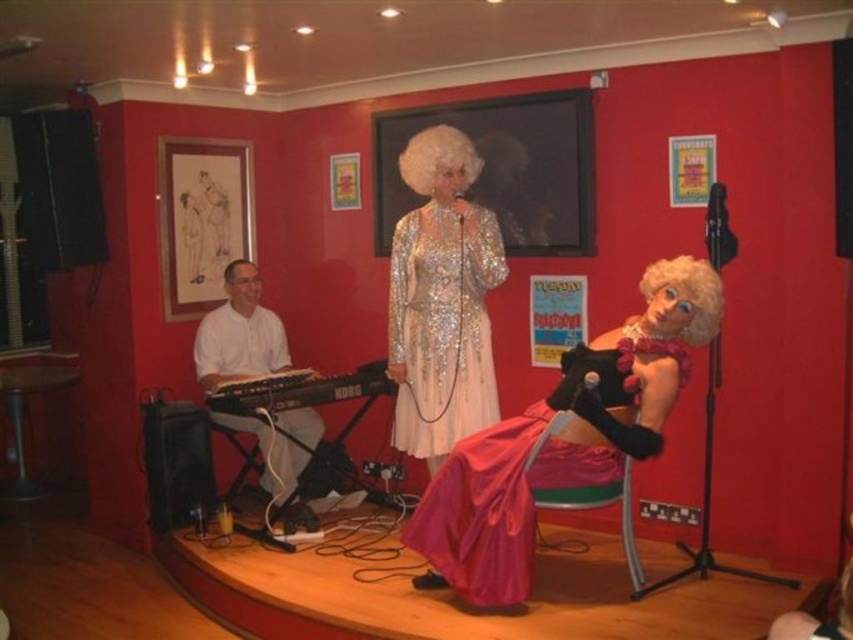
You are a stagehand setting up a new microphone stand. There is a white matte keyboard at left located at point (239, 336). Where should you place the microphone stand so it doesn

The microphone stand should be placed near the white matte keyboard at left at point (239, 336) to ensure the performer can easily access it while playing.

You are a stagehand setting up a spotlight for the performer. The spotlight needs to be positioned so that it can illuminate both the white matte keyboard at left and the white curly wig at upper center without moving. Since the spotlight has a fixed angle, you need to ensure that the taller object is placed closer to the back of the stage to avoid casting a shadow over the shorter one. Which object should be placed closer to the back of the stage?

The white matte keyboard at left is taller than the white curly wig at upper center, so it should be placed closer to the back of the stage to prevent its shadow from covering the shorter object.

You are a stagehand setting up a spotlight. The spotlight needs to be angled to illuminate the taller object between the shiny silver dress at center and the white matte keyboard at left. Which object should the spotlight be aimed at?

The shiny silver dress at center is taller than the white matte keyboard at left, so the spotlight should be aimed at the shiny silver dress at center to illuminate the taller object.